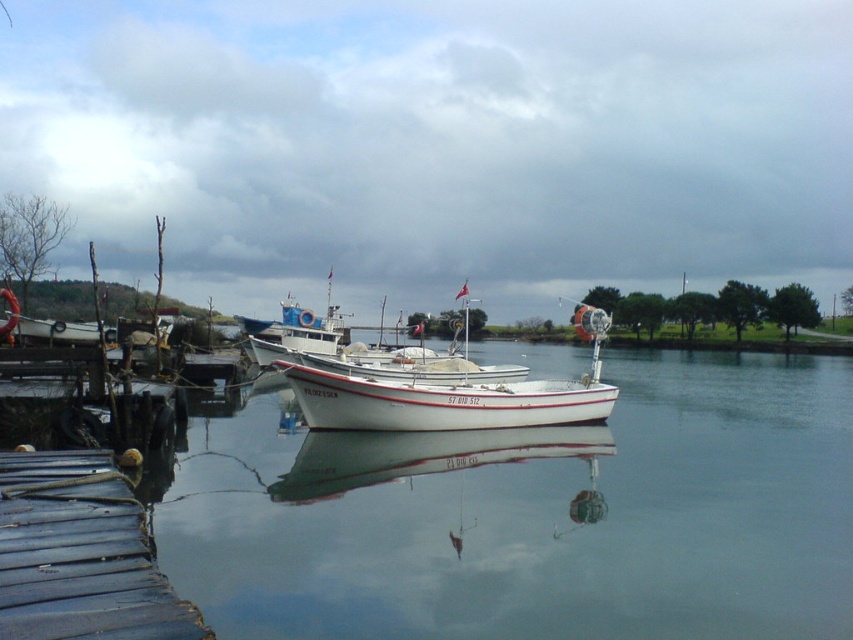
Between dark blue wooden dock at lower left and white matte boat at center, which one appears on the right side from the viewer's perspective?

From the viewer's perspective, white matte boat at center appears more on the right side.

Does dark blue wooden dock at lower left have a greater width compared to white matte boat at center?

Indeed, dark blue wooden dock at lower left has a greater width compared to white matte boat at center.

Is point (148, 614) more distant than point (374, 406)?

No, (148, 614) is closer to viewer.

Identify the location of dark blue wooden dock at lower left. (80, 554).